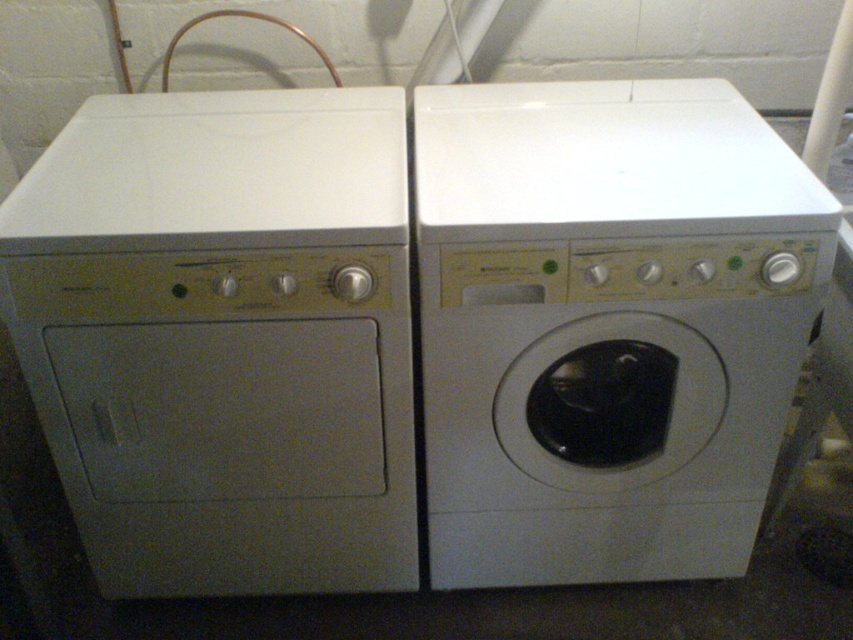
Based on the photo, which is above, white matte washing machine at left or white glossy washing machine at center?

Positioned higher is white glossy washing machine at center.

Does white matte washing machine at left appear under white glossy washing machine at center?

Correct, white matte washing machine at left is located below white glossy washing machine at center.

Where is `white matte washing machine at left`? This screenshot has width=853, height=640. white matte washing machine at left is located at coordinates (223, 337).